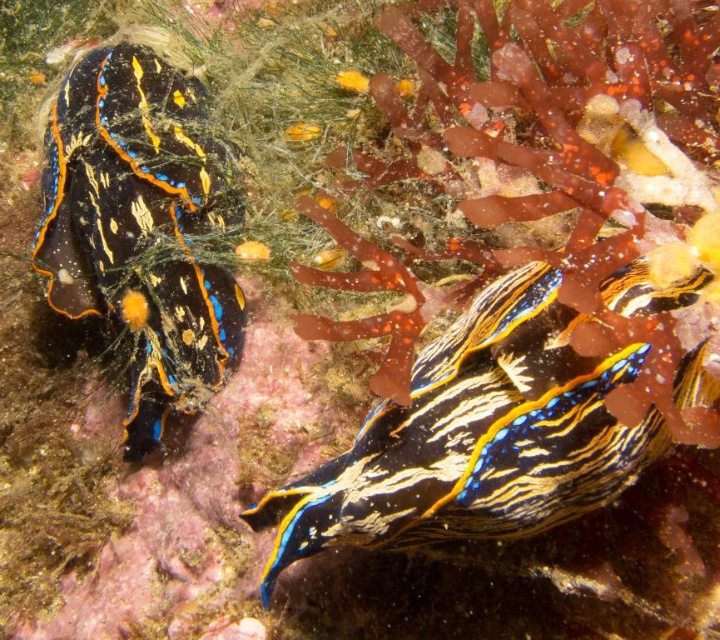
You are a marine biologist observing an underwater scene with two sea slugs. The scene includes a shiny blue and yellow striped sea slug at center and another sea slug on the left. Can you determine which sea slug is located at the specified point coordinates, point (x=474, y=436)?

The shiny blue and yellow striped sea slug at center is located at point (x=474, y=436).

You are a marine biologist studying the spatial distribution of sea slugs in an underwater environment. You observe the shiny blue and yellow striped sea slug at center. Can you determine its exact coordinates in the image?

The shiny blue and yellow striped sea slug at center is located at coordinates point (x=474, y=436).